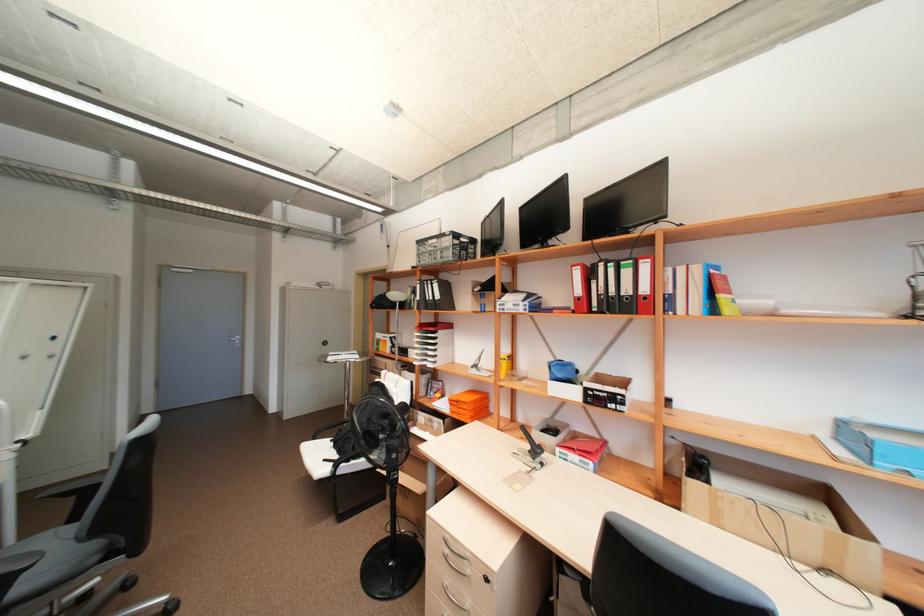
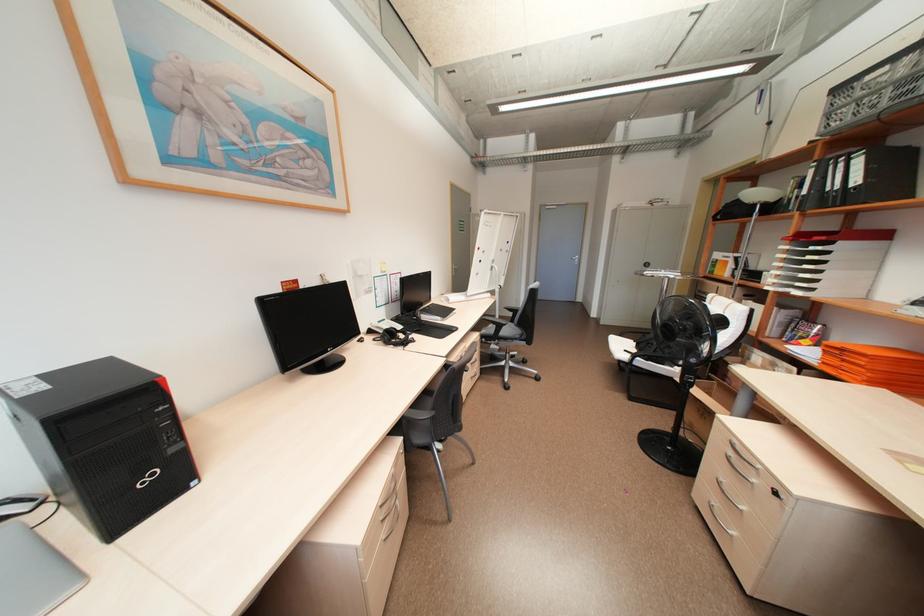
Question: The camera is either moving clockwise (left) or counter-clockwise (right) around the object. The first image is from the beginning of the video and the second image is from the end. Is the camera moving left or right when shooting the video?

Choices:
 (A) Left
 (B) Right

Answer: (B)